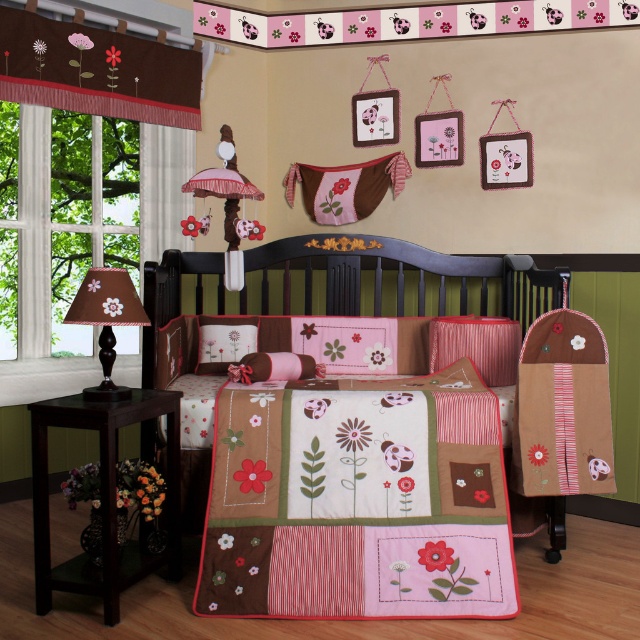
Measure the distance between point (x=106, y=292) and camera.

Point (x=106, y=292) is 3.21 meters from camera.

Does brown fabric lampshade at left have a larger size compared to pink fabric pillow at center?

Correct, brown fabric lampshade at left is larger in size than pink fabric pillow at center.

This screenshot has width=640, height=640. Describe the element at coordinates (106, 321) in the screenshot. I see `brown fabric lampshade at left` at that location.

Identify the location of brown fabric lampshade at left. (106, 321).

Is point (102, 355) closer to viewer compared to point (220, 365)?

Yes, it is in front of point (220, 365).

The height and width of the screenshot is (640, 640). Identify the location of brown fabric lampshade at left. (106, 321).

Is brown fabric valance at upper left wider than pink fabric pillow at center?

Correct, the width of brown fabric valance at upper left exceeds that of pink fabric pillow at center.

Is brown fabric valance at upper left further to the viewer compared to pink fabric pillow at center?

Yes, brown fabric valance at upper left is behind pink fabric pillow at center.

Image resolution: width=640 pixels, height=640 pixels. In order to click on brown fabric valance at upper left in this screenshot , I will do `click(97, 72)`.